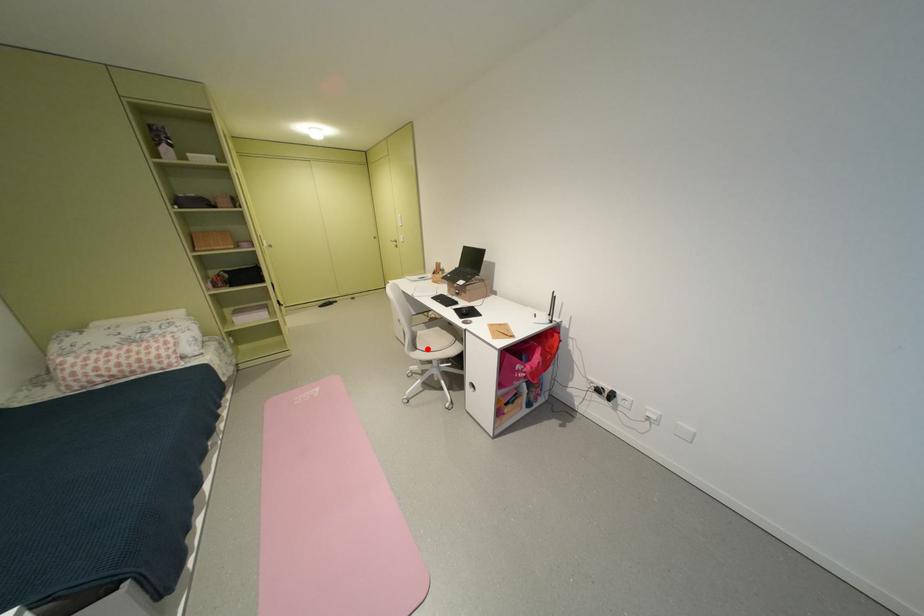
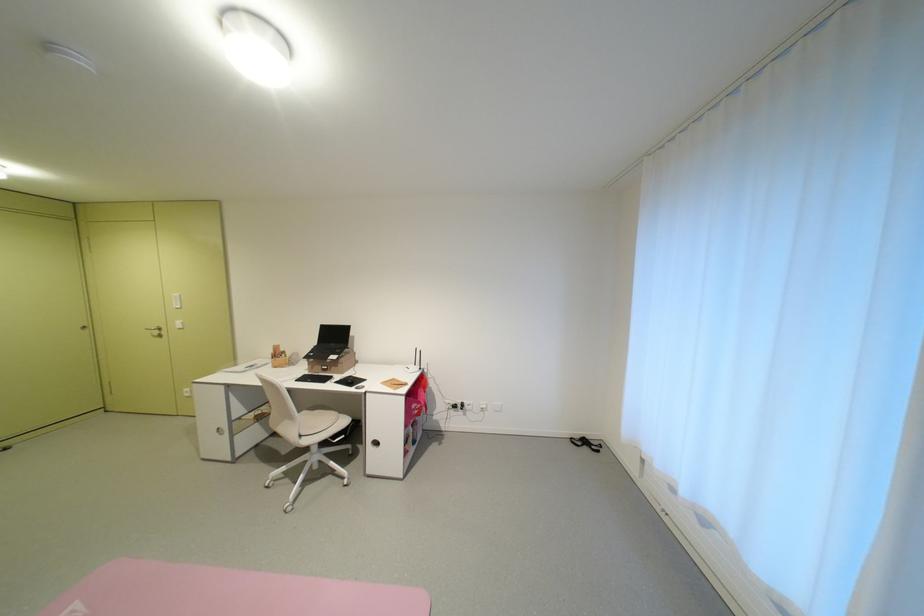
Find the pixel in the second image that matches the highlighted location in the first image.

(311, 436)